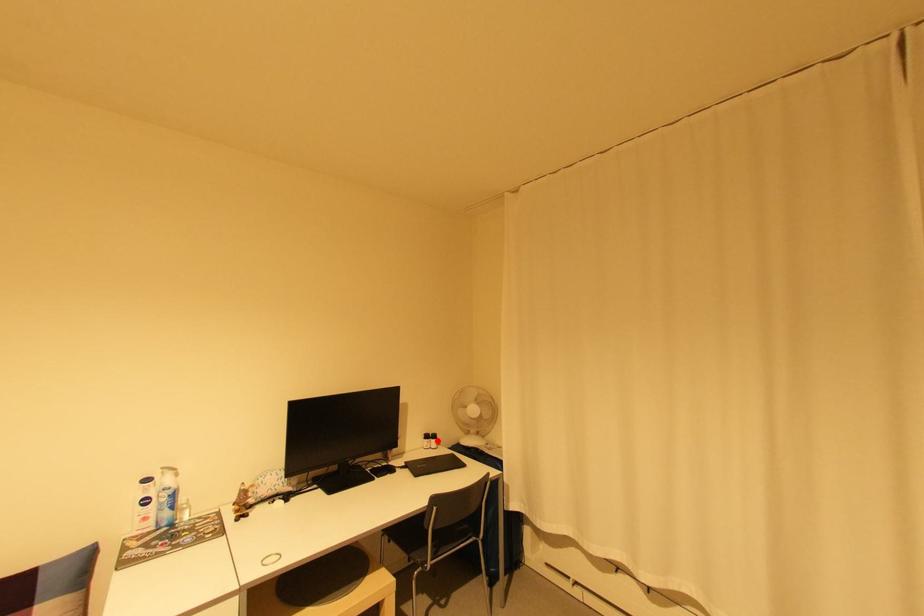
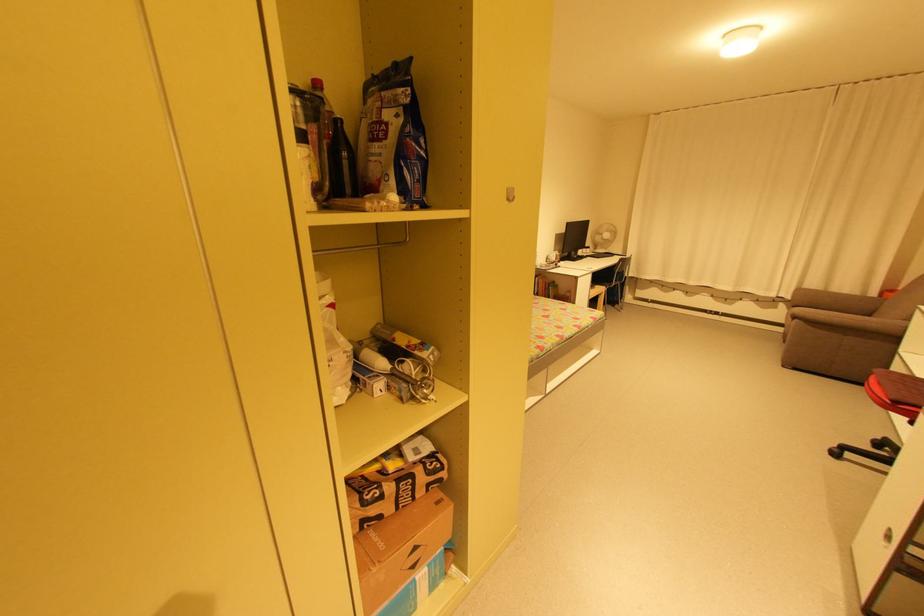
Question: A red point is marked in image1. In image2, is the corresponding 3D point closer to the camera or farther? Reply with the corresponding letter.

Choices:
 (A) The corresponding 3D point is closer.
 (B) The corresponding 3D point is farther.

Answer: (A)